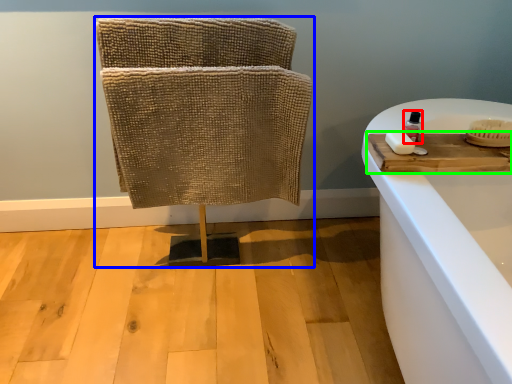
Question: Estimate the real-world distances between objects in this image. Which object is farther from toiletry (highlighted by a red box), furniture (highlighted by a blue box) or wood (highlighted by a green box)?

Choices:
 (A) furniture
 (B) wood

Answer: (A)